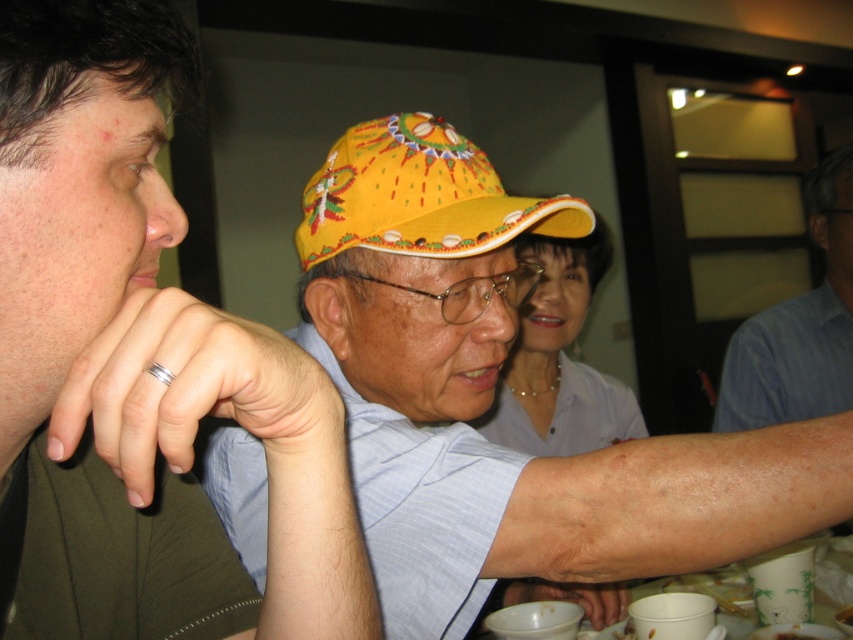
You are a photographer trying to capture a candid shot of the yellow fabric baseball hat at center and the smooth white blouse at center. Since you want to ensure both are fully visible in the frame, which object should you adjust your camera focus to prioritize based on their sizes?

The yellow fabric baseball hat at center is smaller in width than the smooth white blouse at center, so you should prioritize focusing on the smooth white blouse at center to ensure it fits within the frame.